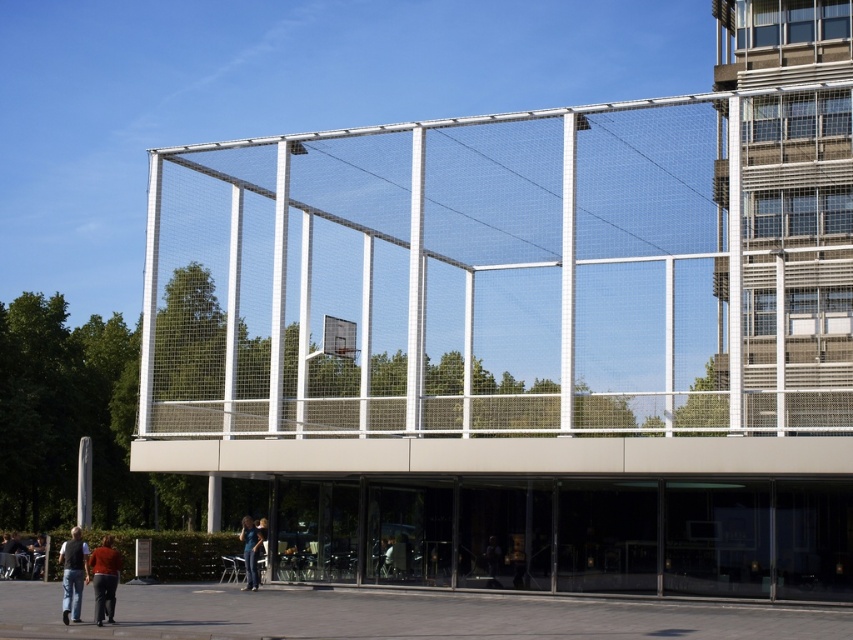
Question: Is denim jeans at lower left above dark brown leather jacket at lower left?

Choices:
 (A) no
 (B) yes

Answer: (B)

Question: Which object appears farthest from the camera in this image?

Choices:
 (A) dark brown leather jacket at lower center
 (B) metallic silver basketball hoop at center
 (C) white mesh fence at center

Answer: (B)

Question: From the image, what is the correct spatial relationship of white mesh fence at center in relation to metallic silver basketball hoop at center?

Choices:
 (A) below
 (B) above

Answer: (B)

Question: Which of these objects is positioned closest to the white mesh fence at center?

Choices:
 (A) dark brown leather jacket at lower center
 (B) denim jacket at lower center
 (C) matte red shirt at lower left
 (D) metallic silver basketball hoop at center

Answer: (D)

Question: Does matte red shirt at lower left appear on the left side of denim jacket at lower center?

Choices:
 (A) no
 (B) yes

Answer: (A)

Question: Which of these objects is positioned closest to the matte red shirt at lower left?

Choices:
 (A) dark brown leather jacket at lower left
 (B) metallic silver basketball hoop at center

Answer: (B)